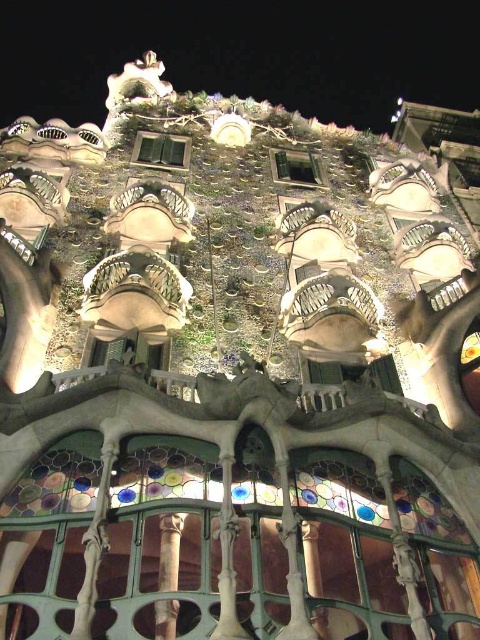
Is point (332, 72) closer to viewer compared to point (140, 147)?

That is False.

How far apart are stained glass balcony at upper center and matte glass window at center?

The distance of stained glass balcony at upper center from matte glass window at center is 530.52 feet.

Who is more forward, (163,12) or (159,154)?

Point (159,154)

The height and width of the screenshot is (640, 480). I want to click on stained glass balcony at upper center, so click(x=243, y=52).

Which is in front, point (159, 529) or point (135, 157)?

Positioned in front is point (159, 529).

Is brown wood column at center positioned at the back of matte glass window at center?

No, brown wood column at center is in front of matte glass window at center.

I want to click on brown wood column at center, so click(169, 550).

Which of these two, matte glass window at center or clear glass window at upper center, stands shorter?

matte glass window at center

Is matte glass window at center below clear glass window at upper center?

Incorrect, matte glass window at center is not positioned below clear glass window at upper center.

Is point (136, 161) positioned before point (283, 150)?

Yes, it is.

Find the location of a particular element. The width and height of the screenshot is (480, 640). matte glass window at center is located at coordinates (160, 150).